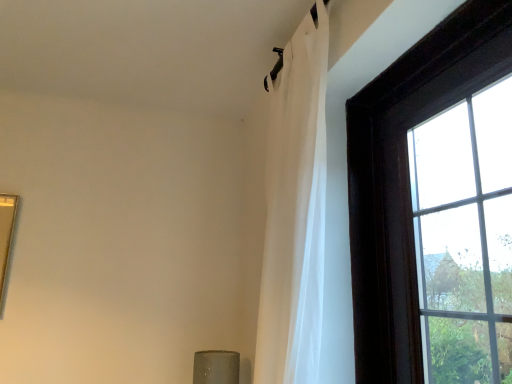
Question: From the image's perspective, is dark wood frame at upper right above white sheer curtain at upper right?

Choices:
 (A) no
 (B) yes

Answer: (A)

Question: Considering the relative sizes of dark wood frame at upper right and white sheer curtain at upper right in the image provided, is dark wood frame at upper right shorter than white sheer curtain at upper right?

Choices:
 (A) no
 (B) yes

Answer: (B)

Question: Does dark wood frame at upper right have a larger size compared to white sheer curtain at upper right?

Choices:
 (A) no
 (B) yes

Answer: (A)

Question: Can you confirm if dark wood frame at upper right is taller than white sheer curtain at upper right?

Choices:
 (A) yes
 (B) no

Answer: (B)

Question: Is dark wood frame at upper right beside white sheer curtain at upper right?

Choices:
 (A) yes
 (B) no

Answer: (B)

Question: Does dark wood frame at upper right have a lesser width compared to white sheer curtain at upper right?

Choices:
 (A) no
 (B) yes

Answer: (B)

Question: Is dark wood frame at upper right a part of white sheer curtain at upper right?

Choices:
 (A) yes
 (B) no

Answer: (B)

Question: From a real-world perspective, does white sheer curtain at upper right sit lower than dark wood frame at upper right?

Choices:
 (A) yes
 (B) no

Answer: (B)

Question: Does white sheer curtain at upper right have a smaller size compared to dark wood frame at upper right?

Choices:
 (A) no
 (B) yes

Answer: (A)

Question: Does white sheer curtain at upper right have a larger size compared to dark wood frame at upper right?

Choices:
 (A) no
 (B) yes

Answer: (B)

Question: Is white sheer curtain at upper right to the right of dark wood frame at upper right from the viewer's perspective?

Choices:
 (A) yes
 (B) no

Answer: (B)

Question: Would you consider white sheer curtain at upper right to be distant from dark wood frame at upper right?

Choices:
 (A) no
 (B) yes

Answer: (A)

Question: In terms of width, does dark wood frame at upper right look wider or thinner when compared to white sheer curtain at upper right?

Choices:
 (A) wide
 (B) thin

Answer: (B)